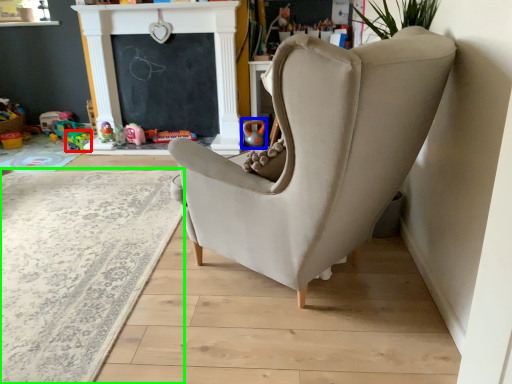
Question: Considering the real-world distances, which object is closest to toy (highlighted by a red box)? toy (highlighted by a blue box) or plain (highlighted by a green box).

Choices:
 (A) toy
 (B) plain

Answer: (A)